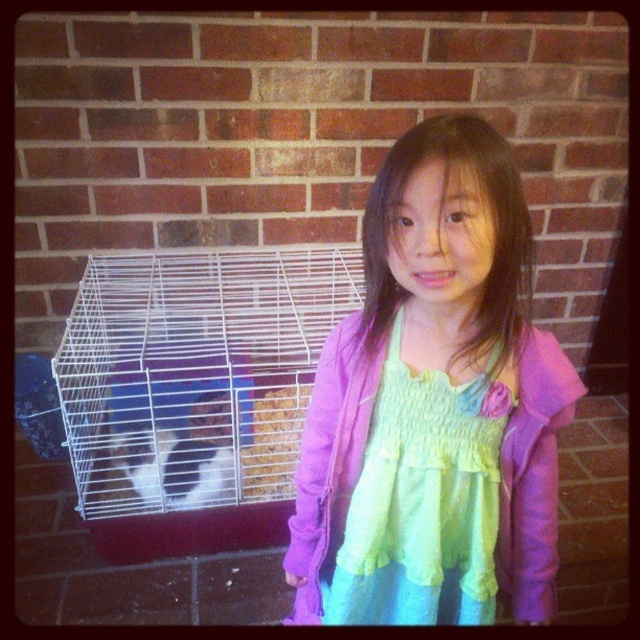
You are a photographer setting up a shoot. You need to place a light source to highlight both the purple satin dress at center and the white wire birdcage at left. Based on their positions, where should you place the light so that both objects are well lit?

The purple satin dress at center is positioned under the white wire birdcage at left, so placing the light source above the birdcage would cast light downward onto both the dress and the birdcage, ensuring both are well lit.

You are a photographer trying to capture the girl and the white wire birdcage at left in the same frame. Based on their positions, can you estimate if the birdcage is within the left half of the image?

The white wire birdcage at left is positioned at coordinates point (195, 392). Since the x coordinate is 0.613, which is greater than 0.5, it means the birdcage is located in the right half of the image. Therefore, the birdcage is not within the left half of the image.

You are a tailor measuring a dress for a client. The client wants to know if the purple satin dress at center can fit inside the white wire birdcage at left for transport. Based on the sizes provided, can it fit?

The purple satin dress at center is smaller than the white wire birdcage at left, so it can fit inside the birdcage.